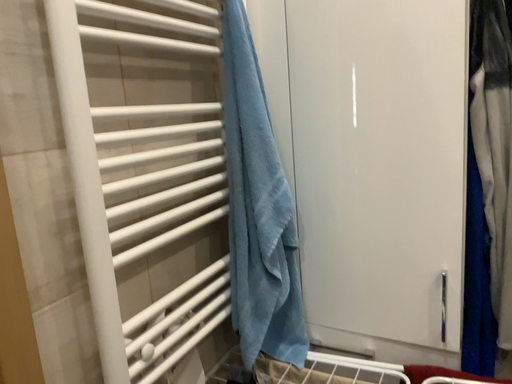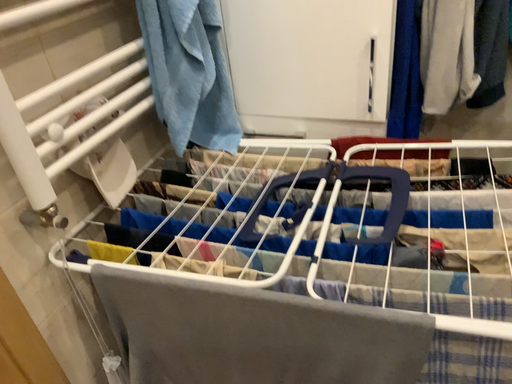
Question: How did the camera likely rotate when shooting the video?

Choices:
 (A) rotated left
 (B) rotated right

Answer: (B)